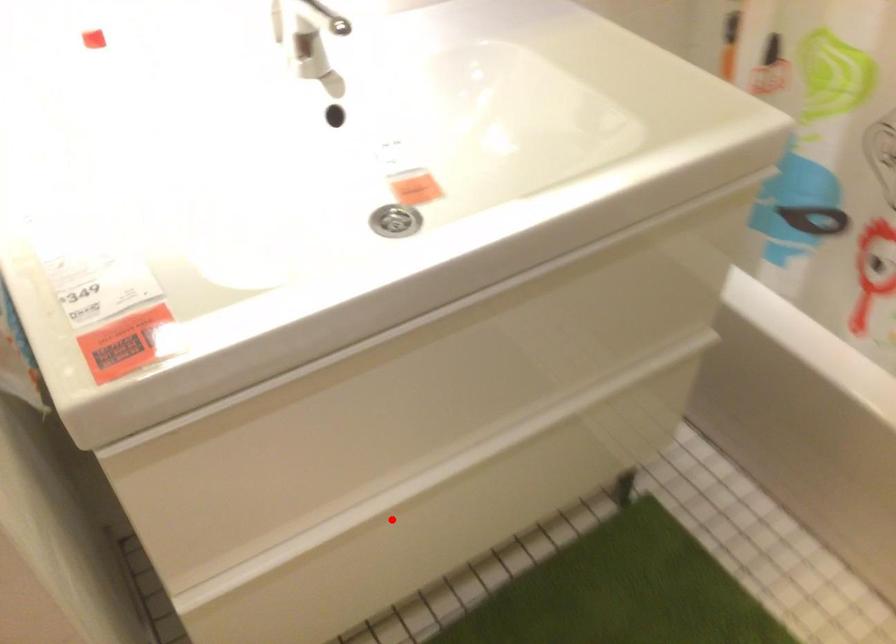
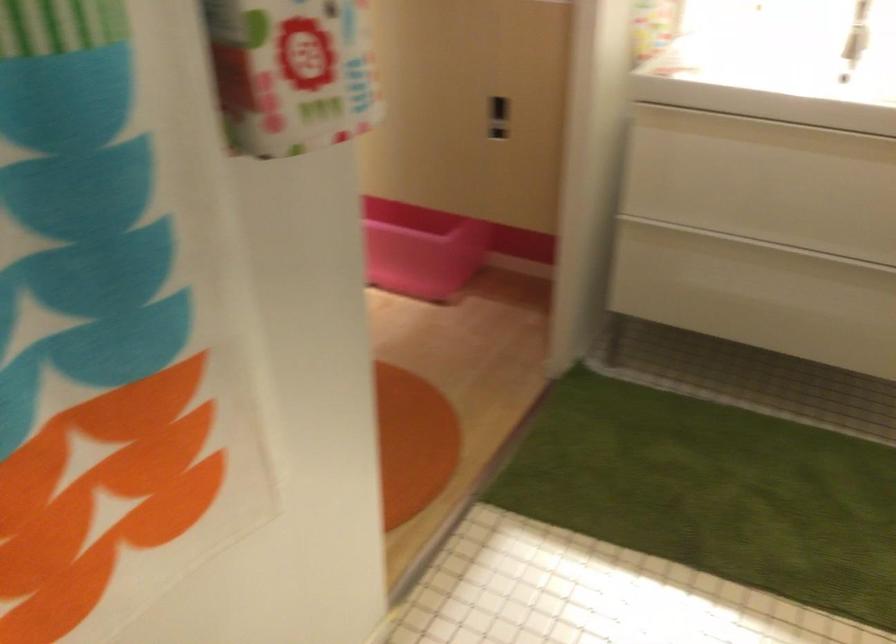
Question: I am providing you with two images of the same scene from different viewpoints. Image1 has a red point marked. In image2, the corresponding 3D location appears at what relative position? Reply with the corresponding letter.

Choices:
 (A) Closer
 (B) Farther

Answer: (B)